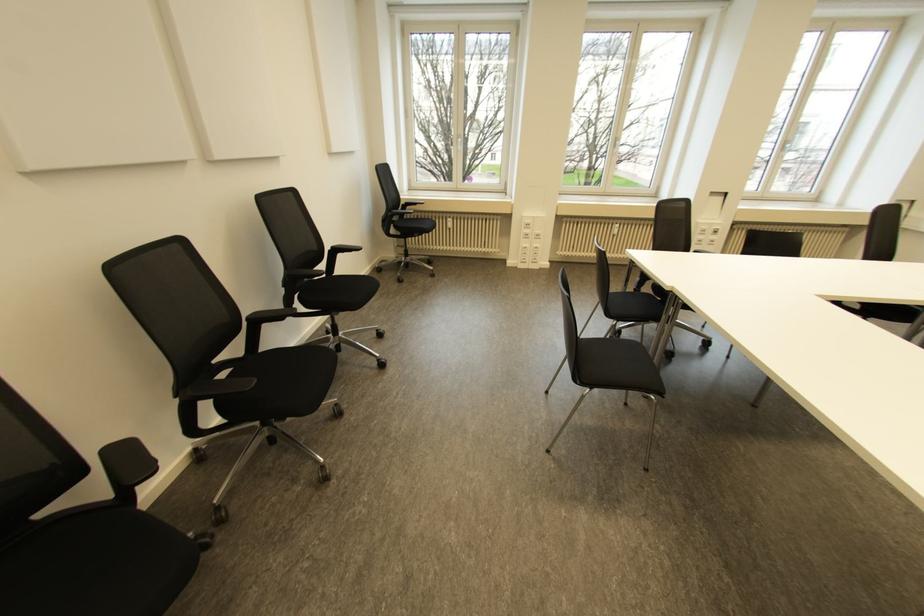
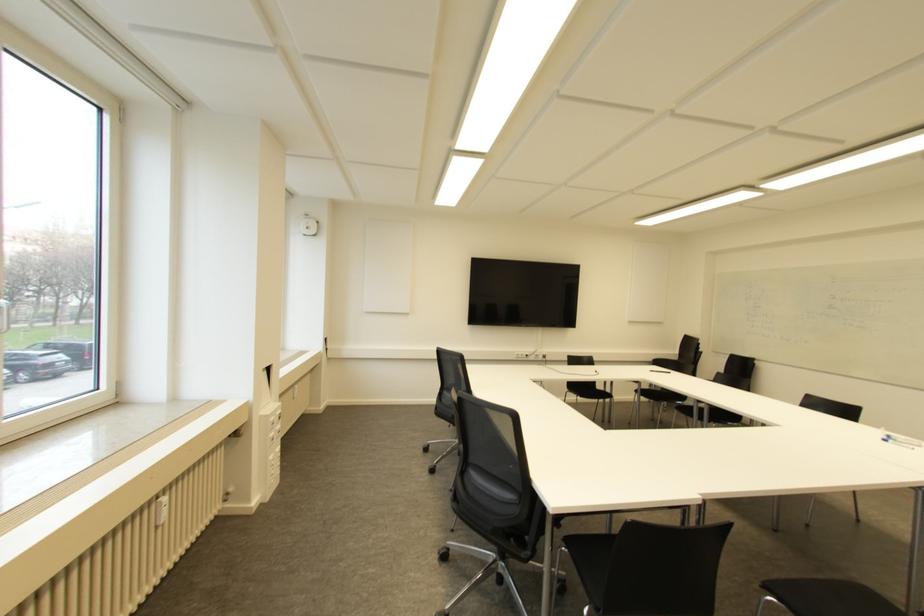
Locate, in the second image, the point that corresponds to point (616, 225) in the first image.

(163, 499)